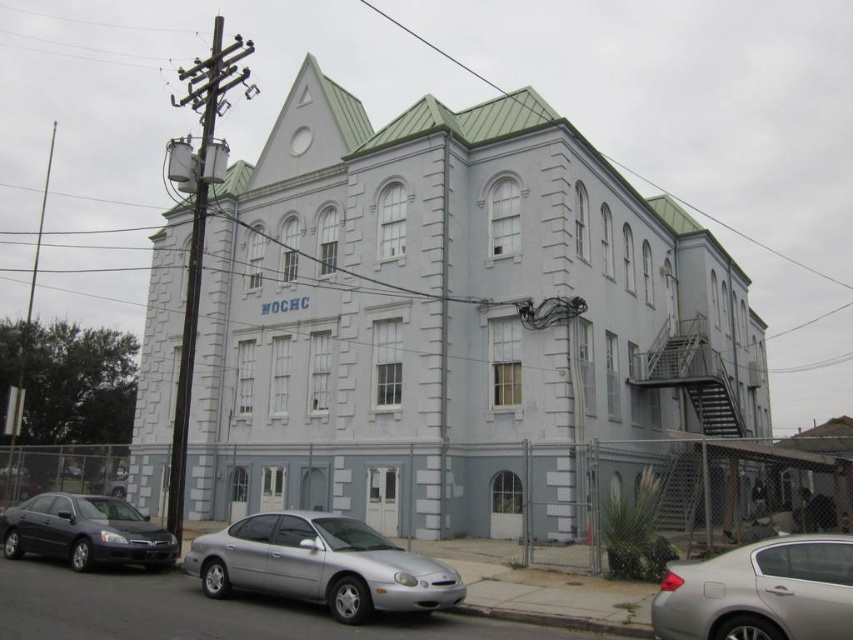
Does point (838, 609) come farther from viewer compared to point (51, 525)?

That is False.

Can you confirm if satin silver sedan at lower right is shorter than shiny black sedan at lower left?

Correct, satin silver sedan at lower right is not as tall as shiny black sedan at lower left.

Does point (747, 618) come farther from viewer compared to point (9, 540)?

That is False.

Identify the location of satin silver sedan at lower right. This screenshot has height=640, width=853. (759, 592).

Can you confirm if silver metallic sedan at center is positioned below shiny black sedan at lower left?

Incorrect, silver metallic sedan at center is not positioned below shiny black sedan at lower left.

Does silver metallic sedan at center lie in front of shiny black sedan at lower left?

Yes, silver metallic sedan at center is closer to the viewer.

Which is behind, point (228, 579) or point (16, 522)?

Positioned behind is point (16, 522).

You are a GUI agent. You are given a task and a screenshot of the screen. Output one action in this format:
    pyautogui.click(x=<x>, y=<y>)
    Task: Click on the silver metallic sedan at center
    
    Given the screenshot: What is the action you would take?
    pyautogui.click(x=321, y=564)

Who is positioned more to the left, silver metallic sedan at center or satin silver sedan at lower right?

silver metallic sedan at center

Who is higher up, silver metallic sedan at center or satin silver sedan at lower right?

satin silver sedan at lower right

Does point (403, 609) lie behind point (780, 604)?

Yes, it is.

At what (x,y) coordinates should I click in order to perform the action: click on silver metallic sedan at center. Please return your answer as a coordinate pair (x, y). Image resolution: width=853 pixels, height=640 pixels. Looking at the image, I should click on (321, 564).